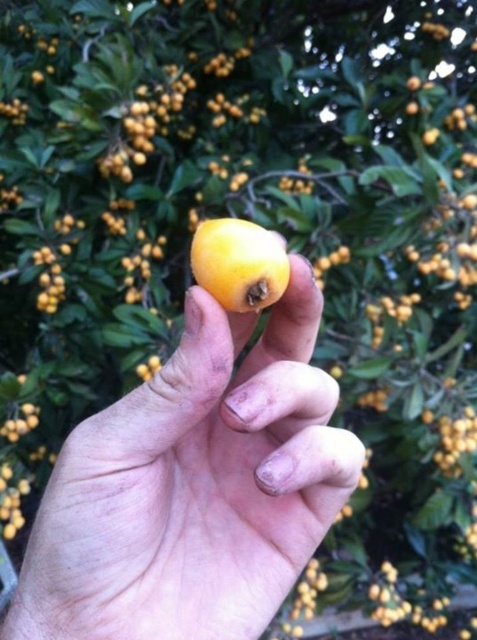
You are a botanist examining the image. The coordinate system starts at the bottom left corner of the image. Can you determine the position of the yellow matte fruit at center relative to the bottom left corner?

The yellow matte fruit at center is located at point (194, 486) relative to the bottom left corner of the image.